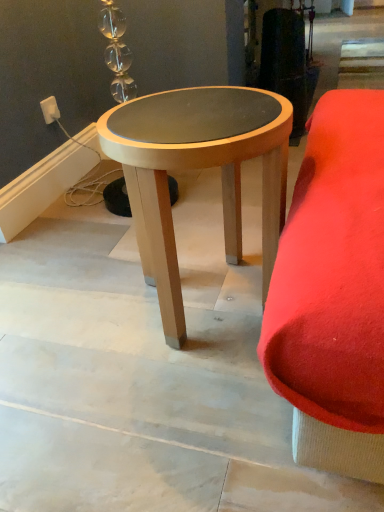
Describe the element at coordinates (50, 110) in the screenshot. I see `white plastic outlet at upper left` at that location.

You are a GUI agent. You are given a task and a screenshot of the screen. Output one action in this format:
    pyautogui.click(x=<x>, y=<y>)
    Task: Click on the white plastic outlet at upper left
    This screenshot has height=512, width=384.
    Given the screenshot: What is the action you would take?
    pyautogui.click(x=50, y=110)

What do you see at coordinates (198, 168) in the screenshot? The height and width of the screenshot is (512, 384). I see `light wood/woodenobject at center` at bounding box center [198, 168].

Identify the location of light wood/woodenobject at center. pyautogui.click(x=198, y=168).

What is the approximate height of light wood/woodenobject at center?

It is 20.53 inches.

The height and width of the screenshot is (512, 384). What are the coordinates of `white plastic outlet at upper left` in the screenshot? It's located at (50, 110).

Considering the positions of objects white plastic outlet at upper left and light wood/woodenobject at center in the image provided, who is more to the right, white plastic outlet at upper left or light wood/woodenobject at center?

From the viewer's perspective, light wood/woodenobject at center appears more on the right side.

Which object is further away from the camera, white plastic outlet at upper left or light wood/woodenobject at center?

white plastic outlet at upper left.

Is point (54, 102) closer or farther from the camera than point (128, 146)?

Point (54, 102).

From the image's perspective, between white plastic outlet at upper left and light wood/woodenobject at center, who is located below?

From the image's view, light wood/woodenobject at center is below.

From a real-world perspective, is white plastic outlet at upper left located beneath light wood/woodenobject at center?

No, from a real-world perspective, white plastic outlet at upper left is not below light wood/woodenobject at center.

Considering the sizes of objects white plastic outlet at upper left and light wood/woodenobject at center in the image provided, who is wider, white plastic outlet at upper left or light wood/woodenobject at center?

light wood/woodenobject at center.

Is white plastic outlet at upper left taller than light wood/woodenobject at center?

In fact, white plastic outlet at upper left may be shorter than light wood/woodenobject at center.

Considering the sizes of objects white plastic outlet at upper left and light wood/woodenobject at center in the image provided, who is bigger, white plastic outlet at upper left or light wood/woodenobject at center?

light wood/woodenobject at center is bigger.

Is white plastic outlet at upper left not inside light wood/woodenobject at center?

Yes, white plastic outlet at upper left is located beyond the bounds of light wood/woodenobject at center.

Is white plastic outlet at upper left far away from light wood/woodenobject at center?

No, white plastic outlet at upper left is not far away from light wood/woodenobject at center.

Does white plastic outlet at upper left turn towards light wood/woodenobject at center?

No, white plastic outlet at upper left is not turned towards light wood/woodenobject at center.

Can you tell me how much white plastic outlet at upper left and light wood/woodenobject at center differ in facing direction?

4.88 degrees separate the facing orientations of white plastic outlet at upper left and light wood/woodenobject at center.

How much distance is there between white plastic outlet at upper left and light wood/woodenobject at center?

37.99 inches.

You are a GUI agent. You are given a task and a screenshot of the screen. Output one action in this format:
    pyautogui.click(x=<x>, y=<y>)
    Task: Click on the electric outlet that appears behind the light wood/woodenobject at center
    
    Given the screenshot: What is the action you would take?
    pyautogui.click(x=50, y=110)

Is light wood/woodenobject at center at the left side of white plastic outlet at upper left?

In fact, light wood/woodenobject at center is to the right of white plastic outlet at upper left.

Considering the positions of objects light wood/woodenobject at center and white plastic outlet at upper left in the image provided, who is in front, light wood/woodenobject at center or white plastic outlet at upper left?

light wood/woodenobject at center is more forward.

Does point (157, 255) come closer to viewer compared to point (47, 114)?

Yes, it is.

Consider the image. From the image's perspective, between light wood/woodenobject at center and white plastic outlet at upper left, who is located below?

From the image's view, light wood/woodenobject at center is below.

From a real-world perspective, which is physically above, light wood/woodenobject at center or white plastic outlet at upper left?

From a 3D spatial view, white plastic outlet at upper left is above.

Which of these two, light wood/woodenobject at center or white plastic outlet at upper left, is wider?

light wood/woodenobject at center.

Considering the relative sizes of light wood/woodenobject at center and white plastic outlet at upper left in the image provided, is light wood/woodenobject at center shorter than white plastic outlet at upper left?

Incorrect, the height of light wood/woodenobject at center does not fall short of that of white plastic outlet at upper left.

Considering the relative sizes of light wood/woodenobject at center and white plastic outlet at upper left in the image provided, is light wood/woodenobject at center smaller than white plastic outlet at upper left?

Incorrect, light wood/woodenobject at center is not smaller in size than white plastic outlet at upper left.

Would you say light wood/woodenobject at center is inside or outside white plastic outlet at upper left?

light wood/woodenobject at center cannot be found inside white plastic outlet at upper left.

Is light wood/woodenobject at center beside white plastic outlet at upper left?

light wood/woodenobject at center is not next to white plastic outlet at upper left, and they're not touching.

Does light wood/woodenobject at center turn towards white plastic outlet at upper left?

No, light wood/woodenobject at center is not aimed at white plastic outlet at upper left.

At what (x,y) coordinates should I click in order to perform the action: click on electric outlet that appears behind the light wood/woodenobject at center. Please return your answer as a coordinate pair (x, y). The image size is (384, 512). Looking at the image, I should click on (50, 110).

At what (x,y) coordinates should I click in order to perform the action: click on coffee table below the white plastic outlet at upper left (from a real-world perspective). Please return your answer as a coordinate pair (x, y). Image resolution: width=384 pixels, height=512 pixels. Looking at the image, I should click on (198, 168).

In order to click on coffee table in front of the white plastic outlet at upper left in this screenshot , I will do `click(198, 168)`.